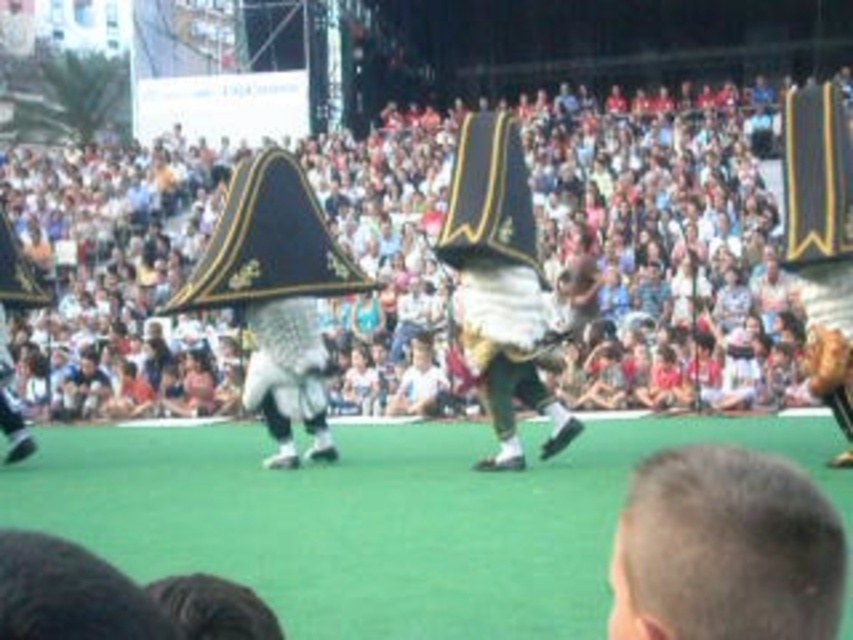
Can you confirm if matte white crowd at upper center is positioned to the right of white fabric costume at center?

In fact, matte white crowd at upper center is to the left of white fabric costume at center.

Is point (677, 262) in front of point (502, 157)?

No.

Find the location of a particular element. matte white crowd at upper center is located at coordinates click(x=663, y=237).

Does matte white crowd at upper center have a larger size compared to blonde hair at lower right?

Yes, matte white crowd at upper center is bigger than blonde hair at lower right.

Is matte white crowd at upper center in front of blonde hair at lower right?

No, matte white crowd at upper center is behind blonde hair at lower right.

Is point (404, 353) farther from viewer compared to point (769, 570)?

Yes.

Locate an element on the screen. matte white crowd at upper center is located at coordinates (663, 237).

Which is in front, point (825, 497) or point (529, 312)?

Point (825, 497)

Who is positioned more to the right, blonde hair at lower right or white fabric costume at center?

blonde hair at lower right

Who is more forward, (686, 598) or (491, 372)?

Point (686, 598) is more forward.

The height and width of the screenshot is (640, 853). What are the coordinates of `blonde hair at lower right` in the screenshot? It's located at (724, 548).